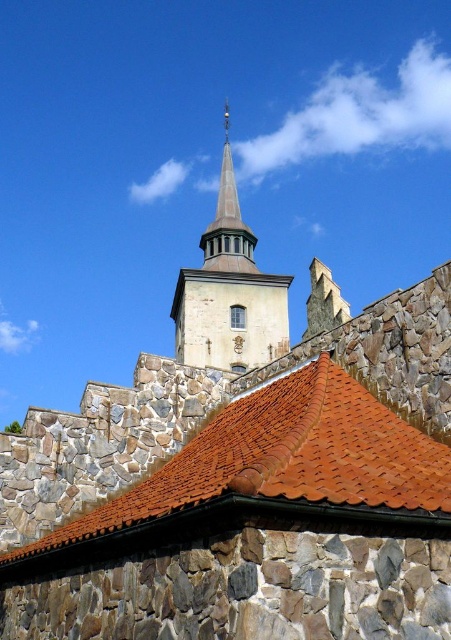
You are a drone operator tasked with capturing aerial footage of the brown tile roof at center and the smooth stone tower at center. The minimum safe distance between the drone and any structure is 30 meters. Can you fly the drone between them without violating safety protocols?

The brown tile roof at center is 34.44 meters from the smooth stone tower at center. Since the minimum safe distance is 30 meters, the drone can safely fly between them as the distance exceeds the required safety margin.

You are an architect designing a new building that must incorporate both a brown tile roof at center and a smooth stone tower at center. Given the spatial constraints of the site, which of the two elements should be placed closer to the building entrance to ensure proper proportions?

The brown tile roof at center should be placed closer to the building entrance because its width is narrower than the smooth stone tower at center, allowing for better proportion and balance in the design.